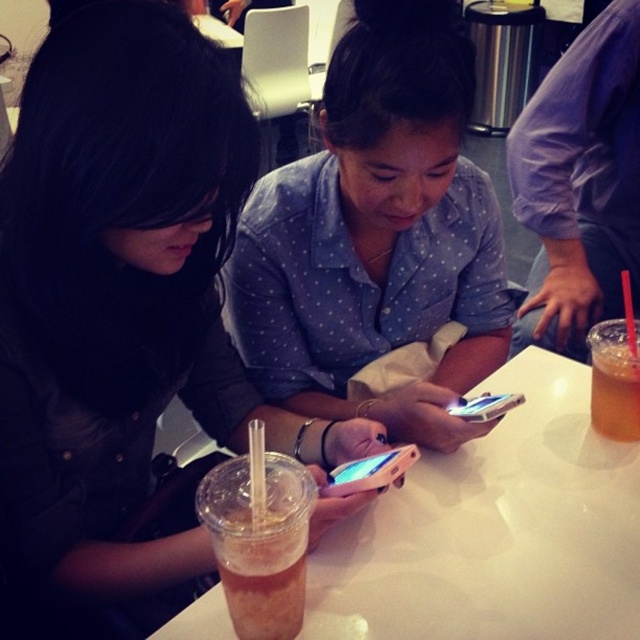
Question: Among these points, which one is nearest to the camera?

Choices:
 (A) (621, 352)
 (B) (33, 124)
 (C) (252, 512)

Answer: (B)

Question: Among these objects, which one is nearest to the camera?

Choices:
 (A) matte black shirt at center
 (B) translucent plastic cup at lower left

Answer: (A)

Question: Does translucent plastic table at center have a smaller size compared to translucent plastic cup at lower right?

Choices:
 (A) yes
 (B) no

Answer: (B)

Question: Which object appears closest to the camera in this image?

Choices:
 (A) translucent plastic cup at lower right
 (B) translucent plastic table at center
 (C) matte blue shirt at center

Answer: (B)

Question: Does matte black shirt at center have a lesser width compared to matte blue shirt at center?

Choices:
 (A) yes
 (B) no

Answer: (A)

Question: Does matte black shirt at center have a greater width compared to white plastic smartphone at center?

Choices:
 (A) yes
 (B) no

Answer: (A)